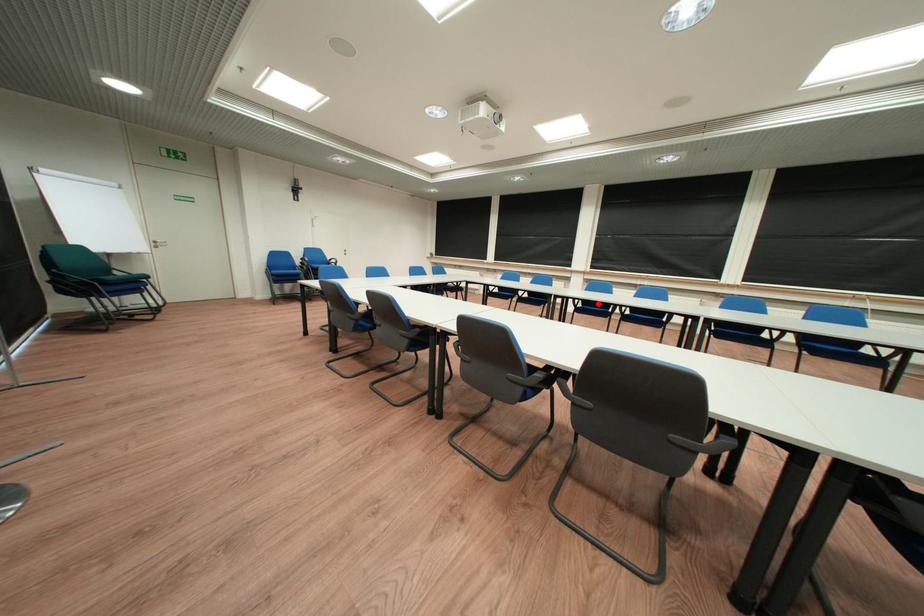
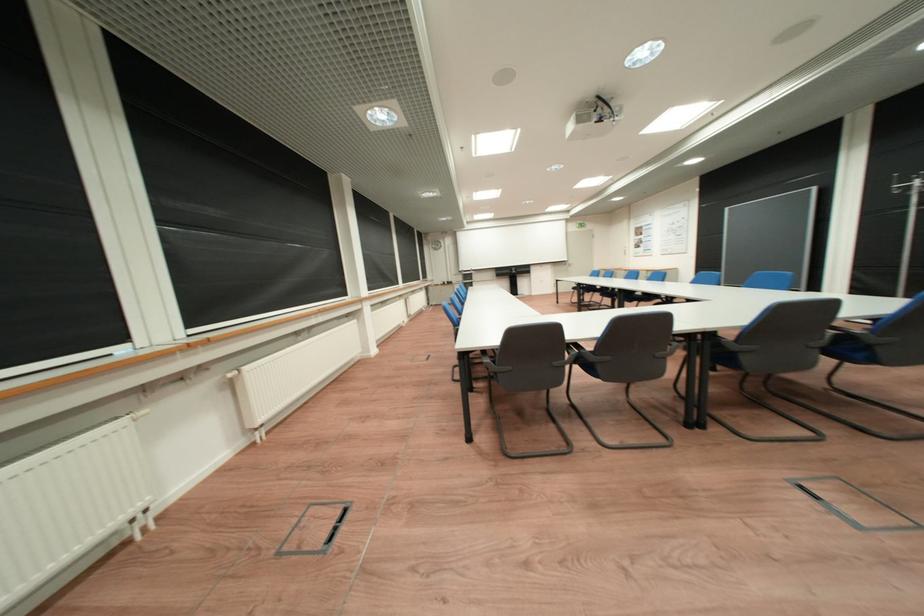
Question: I am providing you with two images of the same scene from different viewpoints. A red point is marked on the first image. At the location where the point appears in image 1, is it still visible in image 2?

Choices:
 (A) Yes
 (B) No

Answer: (B)